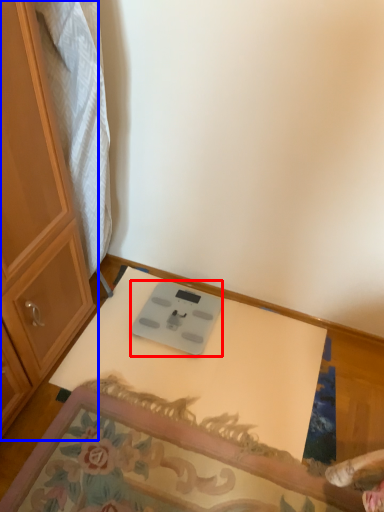
Question: Which object is closer to the camera taking this photo, weight scale (highlighted by a red box) or cabinetry (highlighted by a blue box)?

Choices:
 (A) weight scale
 (B) cabinetry

Answer: (B)